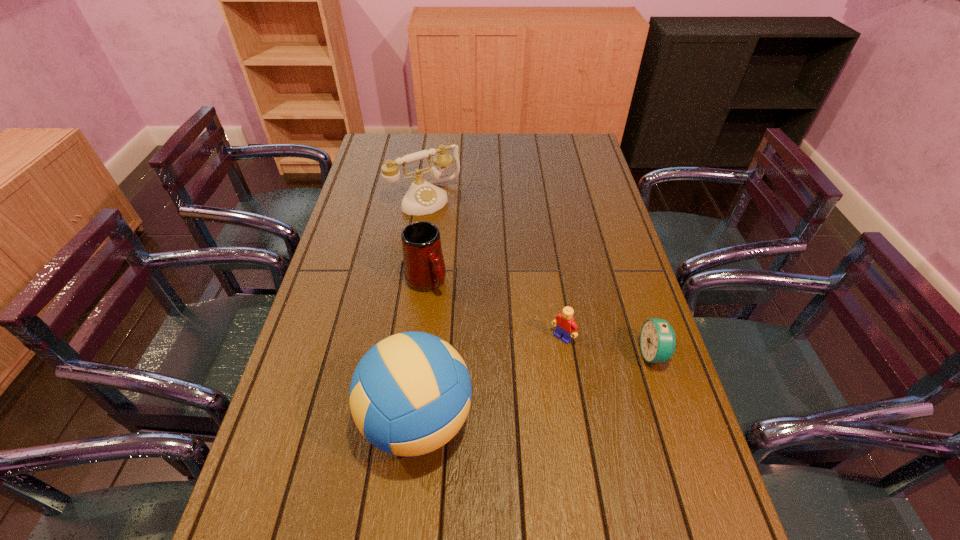
At what (x,y) coordinates should I click in order to perform the action: click on vacant space located on the side of the mug with the handle. Please return your answer as a coordinate pair (x, y). Looking at the image, I should click on (485, 355).

This screenshot has height=540, width=960. Identify the location of blank space located 0.330m on the side of the mug with the handle. (507, 381).

The image size is (960, 540). I want to click on vacant space positioned 0.070m on the face of the Lego, so click(540, 361).

Find the location of a particular element. The height and width of the screenshot is (540, 960). vacant space situated 0.340m on the face of the Lego is located at coordinates (465, 439).

Find the location of a particular element. vacant space located 0.260m on the face of the Lego is located at coordinates (489, 414).

I want to click on free location located 0.110m on the dial of the telephone, so click(x=456, y=231).

You are a GUI agent. You are given a task and a screenshot of the screen. Output one action in this format:
    pyautogui.click(x=<x>, y=<y>)
    Task: Click on the vacant space positioned on the dial of the telephone
    
    Given the screenshot: What is the action you would take?
    pyautogui.click(x=502, y=287)

Find the location of `vacant space located on the dial of the telephone`. vacant space located on the dial of the telephone is located at coordinates (470, 249).

Locate an element on the screen. The height and width of the screenshot is (540, 960). object at the near edge is located at coordinates (410, 394).

This screenshot has width=960, height=540. I want to click on object at the left edge, so click(x=423, y=197).